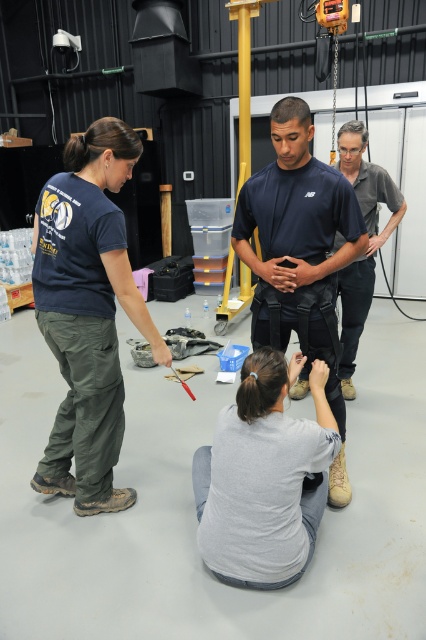
Based on the photo, can you confirm if gray cotton shirt at lower center is shorter than gray cotton shirt at upper right?

Correct, gray cotton shirt at lower center is not as tall as gray cotton shirt at upper right.

Can you confirm if gray cotton shirt at lower center is thinner than gray cotton shirt at upper right?

Incorrect, gray cotton shirt at lower center's width is not less than gray cotton shirt at upper right's.

Is point (284, 435) farther from camera compared to point (348, 342)?

No.

This screenshot has width=426, height=640. I want to click on gray cotton shirt at lower center, so click(264, 476).

Who is higher up, gray cotton shirt at lower center or dark blue fabric shirt at center?

dark blue fabric shirt at center

What do you see at coordinates (264, 476) in the screenshot? I see `gray cotton shirt at lower center` at bounding box center [264, 476].

This screenshot has height=640, width=426. In order to click on gray cotton shirt at lower center in this screenshot , I will do `click(264, 476)`.

Who is more forward, (42, 314) or (342, 406)?

Point (42, 314)

Who is more distant from viewer, [121,492] or [273,211]?

Positioned behind is point [121,492].

This screenshot has width=426, height=640. Find the location of `dark green cargo pants at left`. dark green cargo pants at left is located at coordinates (88, 312).